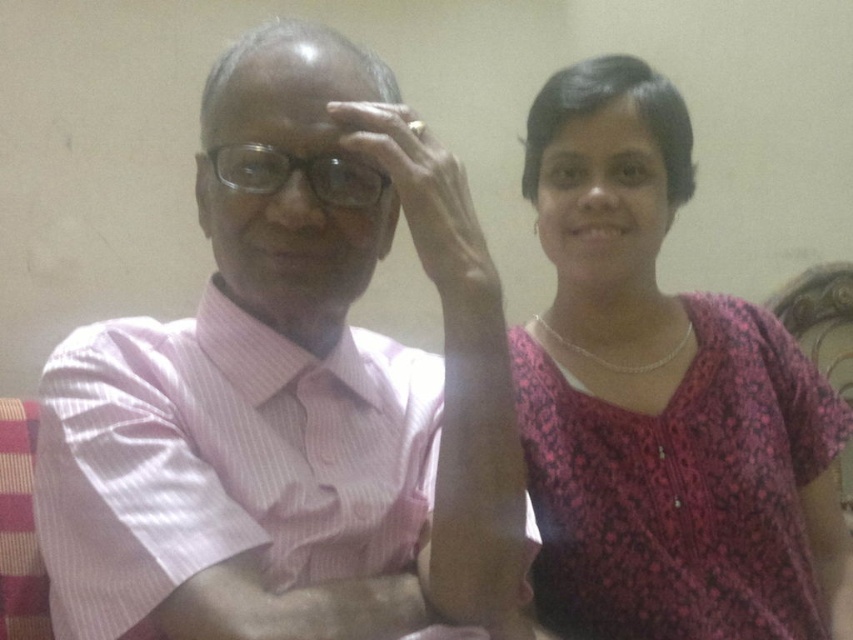
Can you confirm if pink floral dress at right is bigger than transparent plastic glasses at center?

Indeed, pink floral dress at right has a larger size compared to transparent plastic glasses at center.

How distant is pink floral dress at right from transparent plastic glasses at center?

pink floral dress at right is 48.18 centimeters away from transparent plastic glasses at center.

Which is behind, point (729, 484) or point (253, 168)?

Point (729, 484)

The height and width of the screenshot is (640, 853). What are the coordinates of `pink floral dress at right` in the screenshot? It's located at (663, 400).

Which is above, pink striped shirt at left or pink floral dress at right?

pink striped shirt at left is higher up.

The image size is (853, 640). I want to click on pink striped shirt at left, so click(293, 401).

The width and height of the screenshot is (853, 640). Identify the location of pink striped shirt at left. (293, 401).

Which is above, pink striped shirt at left or transparent plastic glasses at center?

transparent plastic glasses at center

Does point (431, 576) come closer to viewer compared to point (216, 170)?

No, it is behind (216, 170).

Looking at this image, who is more forward, [196,410] or [227,177]?

Point [227,177]

Identify the location of pink striped shirt at left. The height and width of the screenshot is (640, 853). (293, 401).